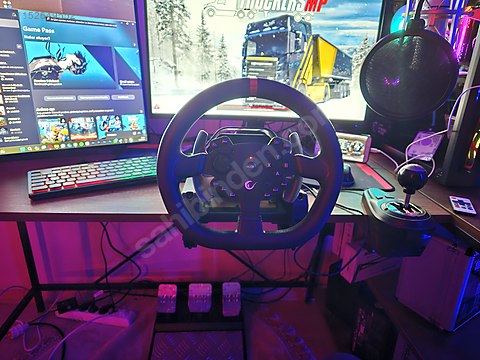
Identify the location of table legs. (314, 276), (29, 242).